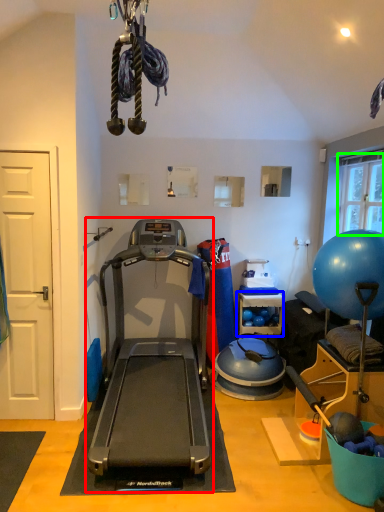
Question: Considering the real-world distances, which object is closest to treadmill (highlighted by a red box)? shelf (highlighted by a blue box) or window screen (highlighted by a green box).

Choices:
 (A) shelf
 (B) window screen

Answer: (A)